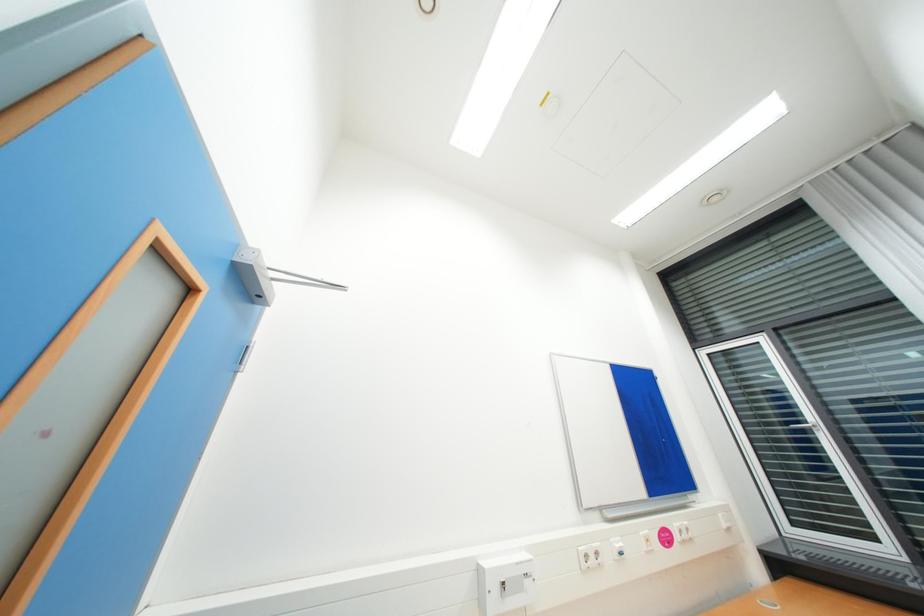
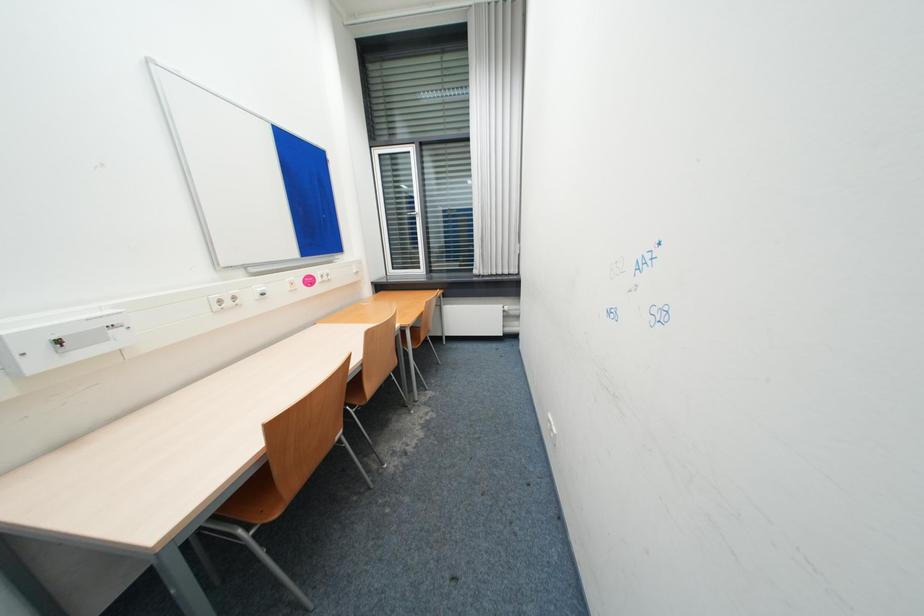
First-person continuous shooting, in which direction is the camera rotating?

The rotation direction of the camera is right-down.